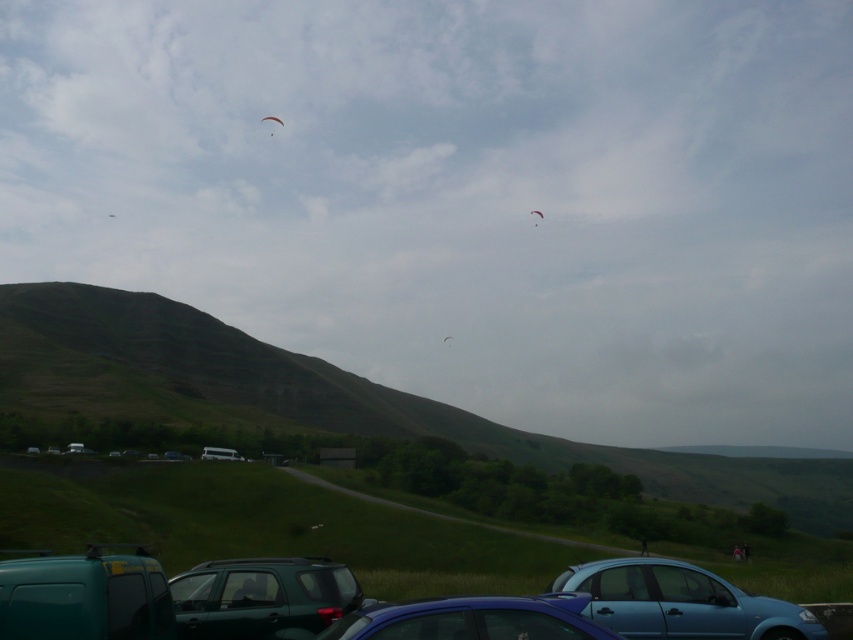
Does green grassy hillside at lower left lie behind matte green suv at lower center?

Yes.

Can you confirm if green grassy hillside at lower left is bigger than matte green suv at lower center?

Yes, green grassy hillside at lower left is bigger than matte green suv at lower center.

Does point (103, 307) come in front of point (207, 634)?

That is False.

In order to click on green grassy hillside at lower left in this screenshot , I will do `click(326, 397)`.

Does matte green suv at lower center have a lesser height compared to white fabric kite at upper center?

No, matte green suv at lower center is not shorter than white fabric kite at upper center.

Who is shorter, matte green suv at lower center or white fabric kite at upper center?

white fabric kite at upper center is shorter.

Is point (285, 579) positioned behind point (270, 120)?

No.

The width and height of the screenshot is (853, 640). Find the location of `matte green suv at lower center`. matte green suv at lower center is located at coordinates (262, 596).

Is metallic blue car at center shorter than red fabric kite at upper center?

Yes.

Who is positioned more to the right, metallic blue car at center or red fabric kite at upper center?

From the viewer's perspective, red fabric kite at upper center appears more on the right side.

Is point (520, 602) positioned in front of point (534, 211)?

Yes, it is in front of point (534, 211).

Image resolution: width=853 pixels, height=640 pixels. What are the coordinates of `metallic blue car at center` in the screenshot? It's located at (473, 620).